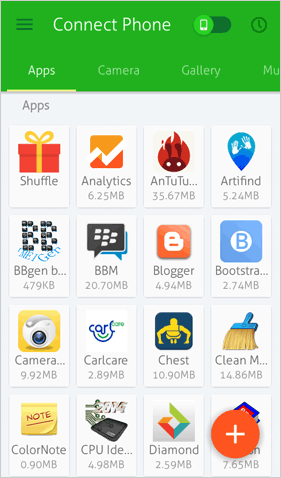
At what (x,y) coordinates should I click in order to perform the action: click on gallery. Please return your answer as a coordinate pair (x, y). The image size is (281, 478). Looking at the image, I should click on (206, 71).